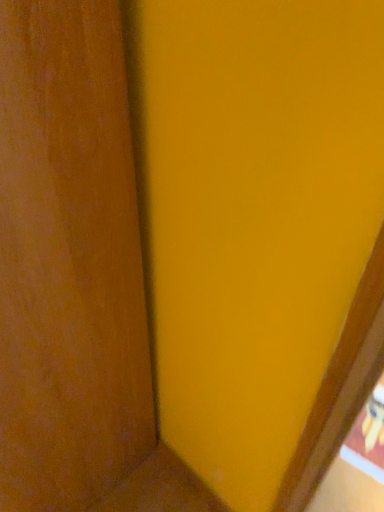
This screenshot has height=512, width=384. I want to click on matte wood door at center, so coord(68,261).

Describe the element at coordinates (68, 261) in the screenshot. I see `matte wood door at center` at that location.

Image resolution: width=384 pixels, height=512 pixels. I want to click on matte wood door at center, so click(68, 261).